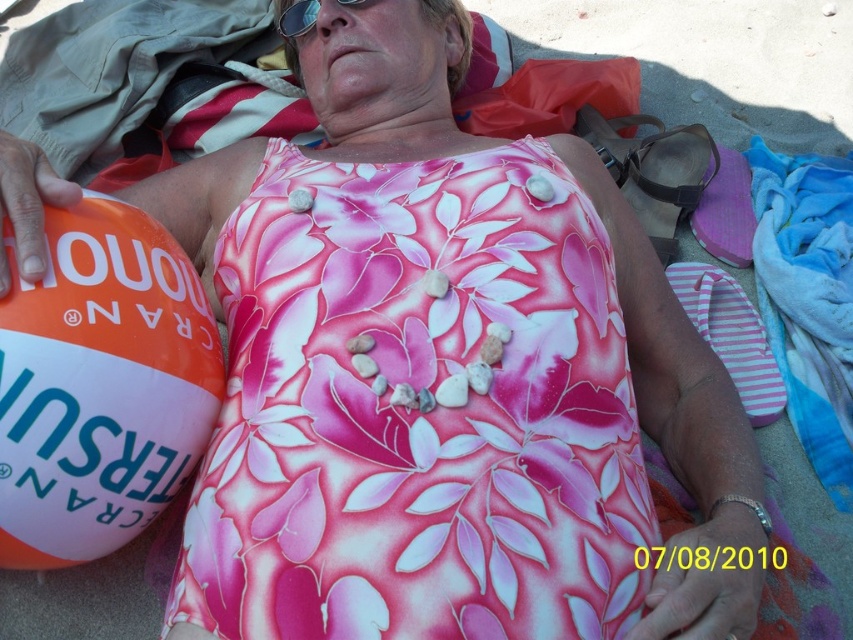
Who is taller, orange/white plastic beach ball at left or sunglasses at upper center?

With more height is orange/white plastic beach ball at left.

Can you confirm if orange/white plastic beach ball at left is bigger than sunglasses at upper center?

Yes.

Does point (39, 356) come behind point (300, 4)?

No, (39, 356) is in front of (300, 4).

The height and width of the screenshot is (640, 853). In order to click on orange/white plastic beach ball at left in this screenshot , I will do `click(100, 385)`.